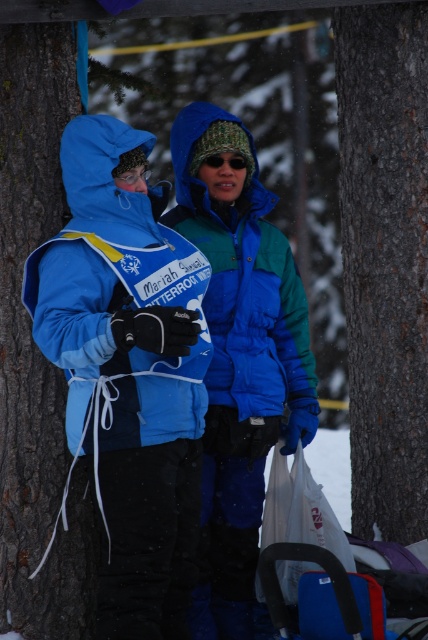
Question: Is brown rough bark at left thinner than camouflage fabric goggles at center?

Choices:
 (A) no
 (B) yes

Answer: (A)

Question: Where is smooth brown bark at center located in relation to matte black goggles at center in the image?

Choices:
 (A) left
 (B) right

Answer: (B)

Question: Which object appears closest to the camera in this image?

Choices:
 (A) camouflage fabric goggles at center
 (B) brown rough bark at left
 (C) matte black goggles at center

Answer: (C)

Question: Considering the real-world distances, which object is closest to the brown rough bark at left?

Choices:
 (A) camouflage fabric goggles at center
 (B) matte blue jacket at center
 (C) matte black goggles at center

Answer: (B)

Question: Is matte blue jacket at center positioned in front of camouflage fabric goggles at center?

Choices:
 (A) no
 (B) yes

Answer: (B)

Question: Which point is farther to the camera?

Choices:
 (A) matte black goggles at center
 (B) camouflage fabric goggles at center

Answer: (B)